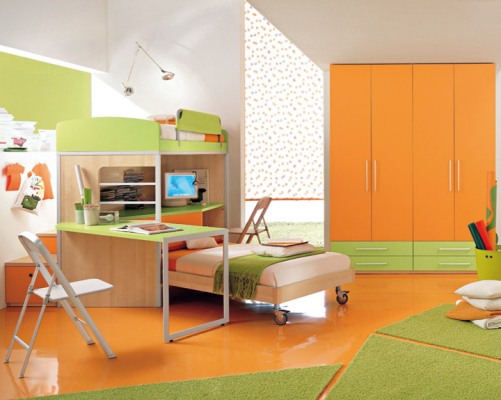
Locate an element on the screen. This screenshot has width=501, height=400. bed is located at coordinates (294, 273).